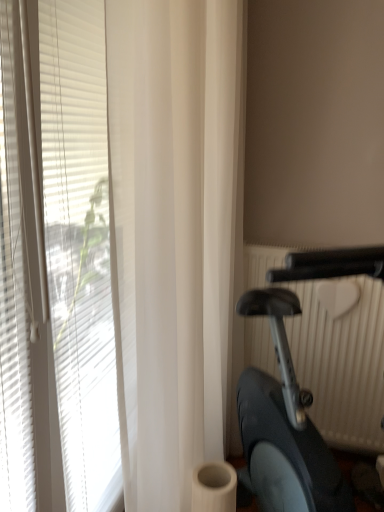
Question: Considering the positions of metallic silver stationary bicycle at right and white matte blinds at left in the image, is metallic silver stationary bicycle at right taller or shorter than white matte blinds at left?

Choices:
 (A) tall
 (B) short

Answer: (B)

Question: Is metallic silver stationary bicycle at right spatially inside white matte blinds at left, or outside of it?

Choices:
 (A) outside
 (B) inside

Answer: (A)

Question: In terms of width, does metallic silver stationary bicycle at right look wider or thinner when compared to white matte blinds at left?

Choices:
 (A) thin
 (B) wide

Answer: (B)

Question: Based on their positions, is white matte blinds at left located to the left or right of metallic silver stationary bicycle at right?

Choices:
 (A) left
 (B) right

Answer: (A)

Question: Considering the positions of white matte blinds at left and metallic silver stationary bicycle at right in the image, is white matte blinds at left bigger or smaller than metallic silver stationary bicycle at right?

Choices:
 (A) small
 (B) big

Answer: (A)

Question: From their relative heights in the image, would you say white matte blinds at left is taller or shorter than metallic silver stationary bicycle at right?

Choices:
 (A) tall
 (B) short

Answer: (A)

Question: From a real-world perspective, is white matte blinds at left physically located above or below metallic silver stationary bicycle at right?

Choices:
 (A) below
 (B) above

Answer: (B)